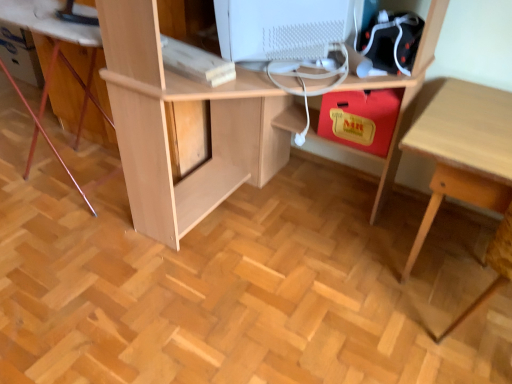
Question: Is light wood table at lower right not near white matte computer monitor at upper center?

Choices:
 (A) yes
 (B) no

Answer: (B)

Question: Is light wood table at lower right shorter than white matte computer monitor at upper center?

Choices:
 (A) yes
 (B) no

Answer: (B)

Question: Is light wood table at lower right bigger than white matte computer monitor at upper center?

Choices:
 (A) yes
 (B) no

Answer: (A)

Question: From the image's perspective, is light wood table at lower right below white matte computer monitor at upper center?

Choices:
 (A) yes
 (B) no

Answer: (A)

Question: Is light wood table at lower right to the right of white matte computer monitor at upper center from the viewer's perspective?

Choices:
 (A) yes
 (B) no

Answer: (A)

Question: Considering the positions of point (480, 107) and point (298, 29), is point (480, 107) closer or farther from the camera than point (298, 29)?

Choices:
 (A) closer
 (B) farther

Answer: (B)

Question: From a real-world perspective, is light wood table at lower right above or below white matte computer monitor at upper center?

Choices:
 (A) below
 (B) above

Answer: (A)

Question: Is light wood table at lower right in front of or behind white matte computer monitor at upper center in the image?

Choices:
 (A) front
 (B) behind

Answer: (A)

Question: Would you say light wood table at lower right is to the left or to the right of white matte computer monitor at upper center in the picture?

Choices:
 (A) right
 (B) left

Answer: (A)

Question: Based on their sizes in the image, would you say white matte computer monitor at upper center is bigger or smaller than light wood desk at center?

Choices:
 (A) big
 (B) small

Answer: (B)

Question: Is white matte computer monitor at upper center in front of or behind light wood desk at center in the image?

Choices:
 (A) behind
 (B) front

Answer: (A)

Question: Is white matte computer monitor at upper center situated inside light wood desk at center or outside?

Choices:
 (A) outside
 (B) inside

Answer: (B)

Question: Does point (234, 52) appear closer or farther from the camera than point (293, 82)?

Choices:
 (A) closer
 (B) farther

Answer: (A)

Question: Is light wood table at lower right wider or thinner than light wood computer desk at lower left?

Choices:
 (A) thin
 (B) wide

Answer: (B)

Question: From a real-world perspective, is light wood table at lower right physically located above or below light wood computer desk at lower left?

Choices:
 (A) below
 (B) above

Answer: (A)